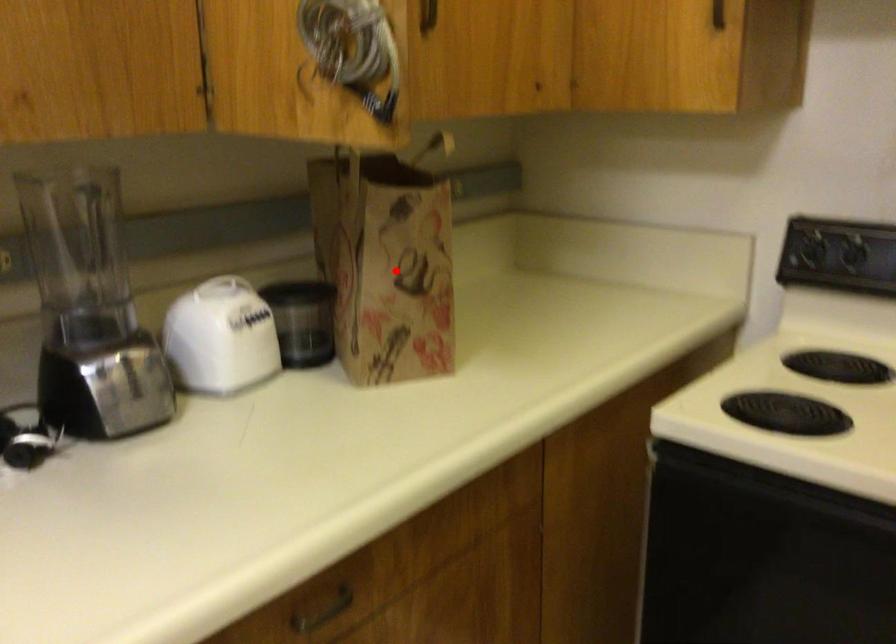
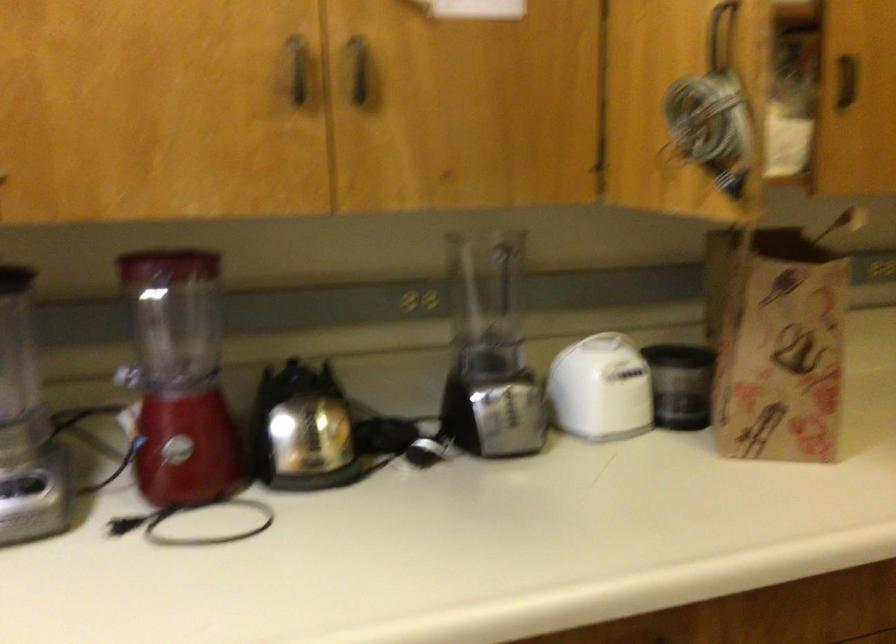
The point at the highlighted location is marked in the first image. Where is the corresponding point in the second image?

(777, 341)